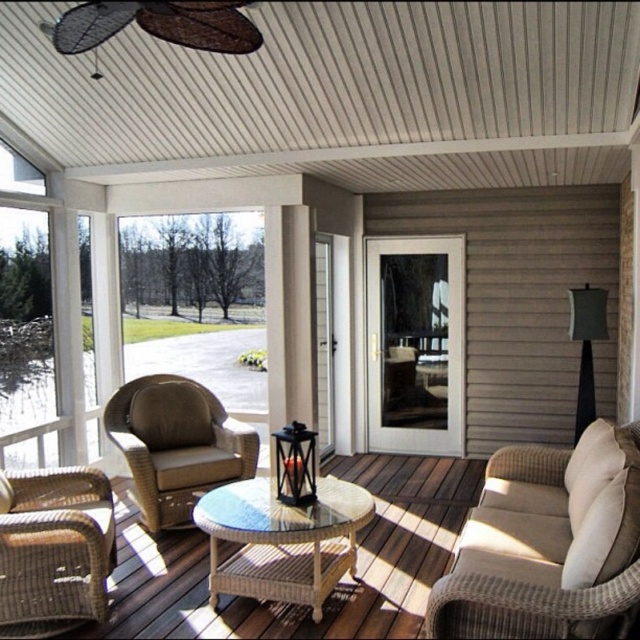
You are sitting in the brown wicker rocking chair at left and want to look outside through the clear glass door at center. Can you see the door from your current position?

The clear glass door at center is located above the brown wicker rocking chair at left, so yes, you can see the door from your current position as it is positioned above you.

You are sitting in the beige woven armchair at lower right and want to reach the brown wicker rocking chair at left. Can you stand up and walk directly to it without moving around any furniture?

The beige woven armchair at lower right is positioned under the brown wicker rocking chair at left, which means they are stacked vertically. Since they are stacked, there is no space between them for you to walk through directly. You would need to move around other furniture or adjust the chairs to reach the rocking chair.